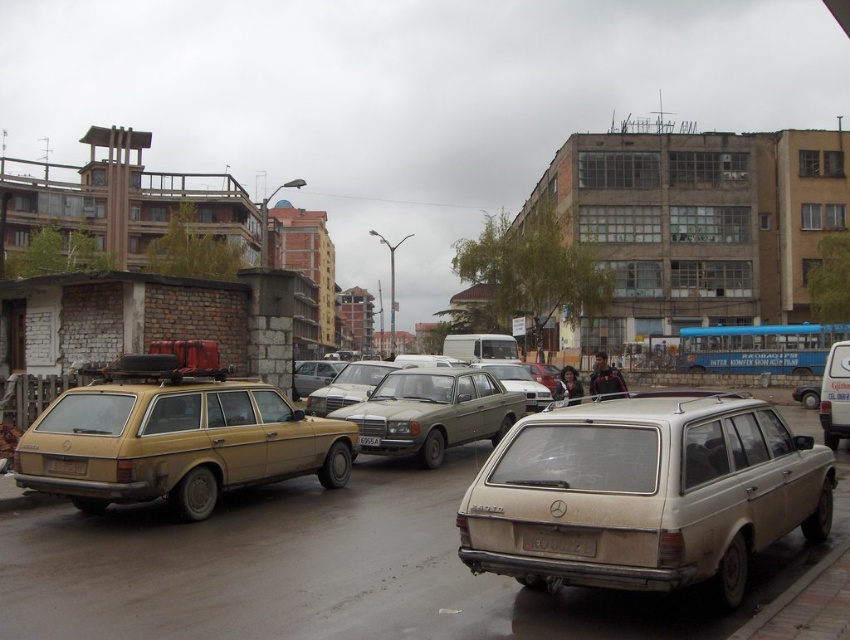
You are a delivery driver who needs to park your truck in this area. You see the dirty beige station wagon at center and the green matte sedan at center. Which vehicle should you avoid parking next to if you want to ensure there is enough space for your truck?

You should avoid parking next to the green matte sedan at center because the dirty beige station wagon at center has a smaller size compared to green matte sedan at center, meaning the sedan takes up more space.

What are the coordinates of the green matte sedan at center?

The green matte sedan at center is located at coordinates point (434,412).

You are a delivery driver who needs to park your 5.5 meter long truck between the green matte sedan at center and the silver metallic sedan at center. Can you fit your truck in the space between them?

The green matte sedan at center and the silver metallic sedan at center are 7.79 meters apart. Since your truck is 5.5 meters long, there is enough space between them to park your truck.